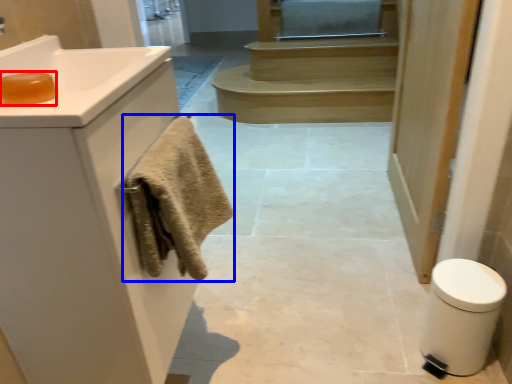
Question: Which of the following is the farthest to the observer, soap (highlighted by a red box) or bath towel (highlighted by a blue box)?

Choices:
 (A) soap
 (B) bath towel

Answer: (B)